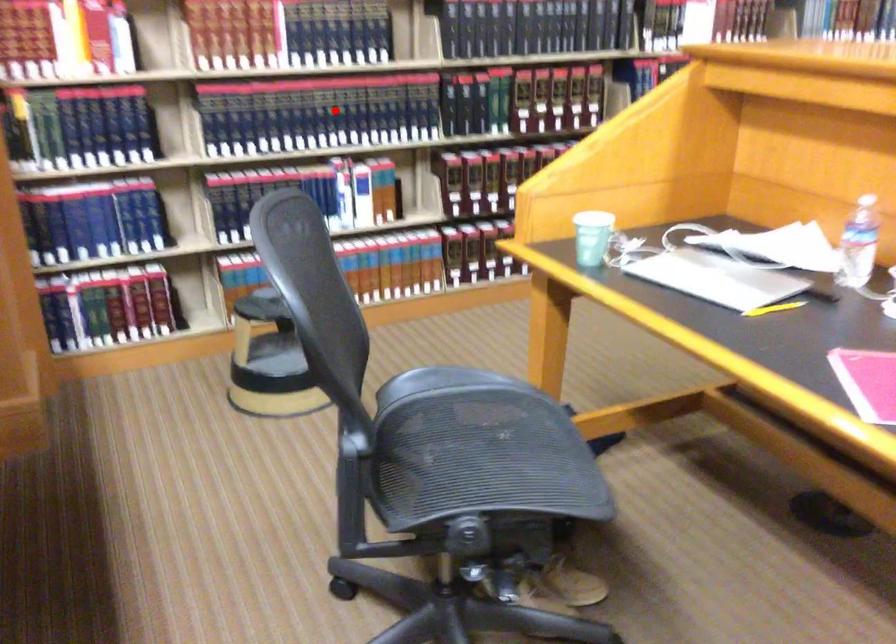
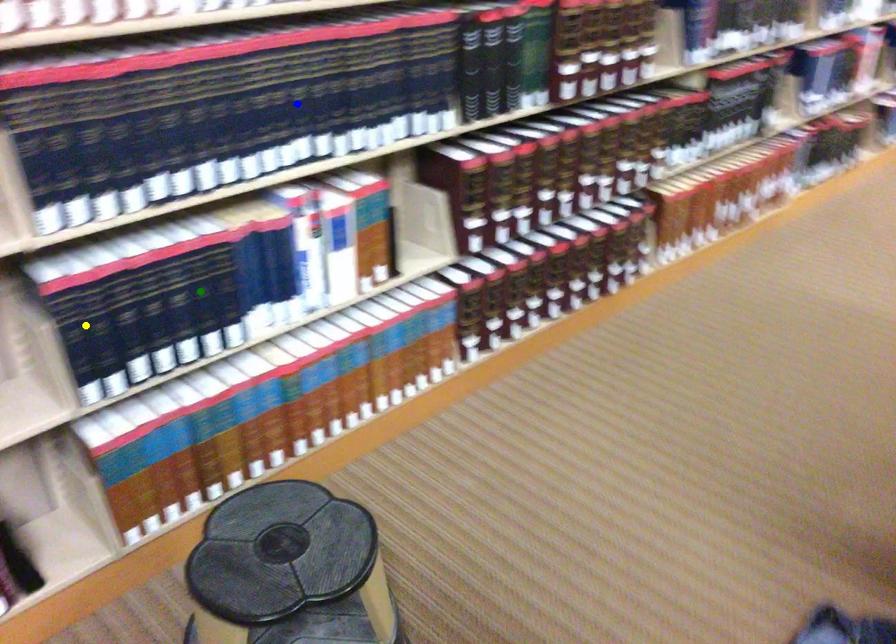
Question: I am providing you with two images of the same scene from different viewpoints. A red point is marked on the first image. You are given multiple points on the second image. Which mark in image 2 goes with the point in image 1?

Choices:
 (A) yellow point
 (B) green point
 (C) blue point

Answer: (C)